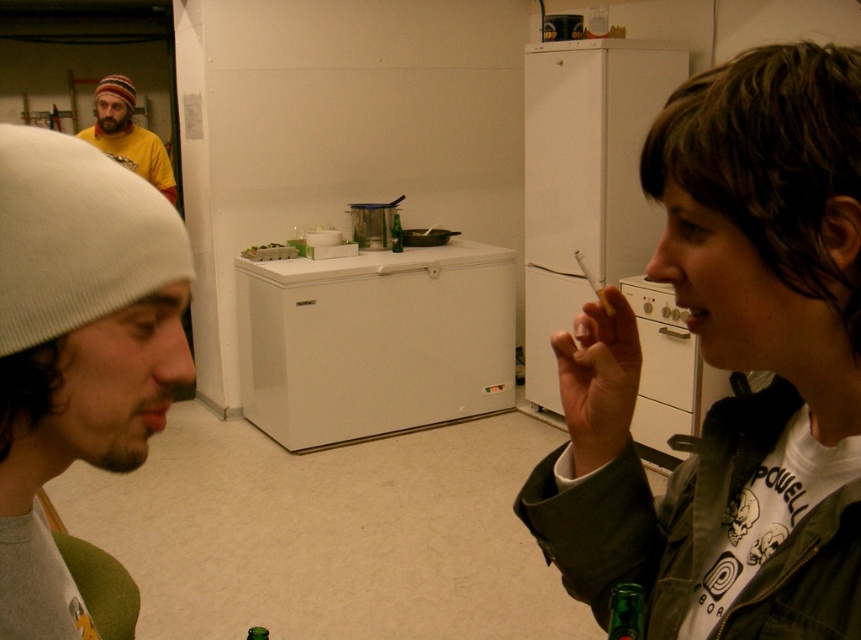
Is point (5, 129) behind point (626, 628)?

No, it is not.

What do you see at coordinates (76, 349) in the screenshot? This screenshot has height=640, width=861. I see `white knit cap at left` at bounding box center [76, 349].

Locate an element on the screen. Image resolution: width=861 pixels, height=640 pixels. white knit cap at left is located at coordinates (76, 349).

Who is shorter, white knit cap at left or white matte refrigerator at upper center?

white knit cap at left is shorter.

Is the position of white knit cap at left less distant than that of white matte refrigerator at upper center?

Yes, white knit cap at left is closer to the viewer.

Does point (56, 243) come behind point (570, 161)?

That is False.

Where is `white knit cap at left`? This screenshot has height=640, width=861. white knit cap at left is located at coordinates (76, 349).

Does point (620, 618) come closer to viewer compared to point (393, 216)?

That is True.

Who is more distant from viewer, [635,602] or [401,248]?

The point [401,248] is behind.

Where is `green glass bottle at lower right`? green glass bottle at lower right is located at coordinates (624, 611).